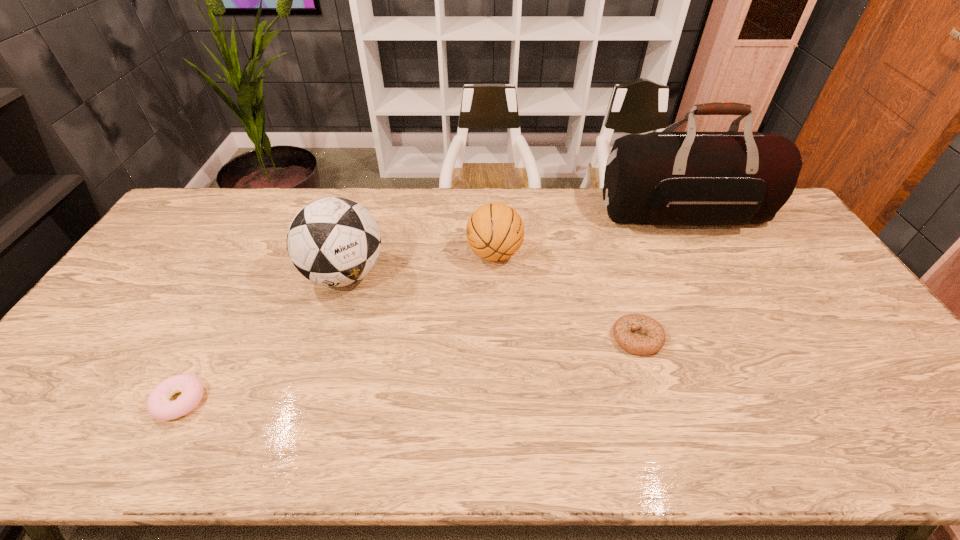
Locate an element on the screen. duffel bag is located at coordinates (691, 178).

The width and height of the screenshot is (960, 540). In order to click on the second object from left to right in this screenshot , I will do `click(332, 241)`.

This screenshot has width=960, height=540. Identify the location of the fourth shortest object. (332, 241).

Find the location of `the third tallest object`. the third tallest object is located at coordinates (495, 231).

Locate an element on the screen. The height and width of the screenshot is (540, 960). the third object from right to left is located at coordinates (495, 231).

Identify the location of the fourth farthest object. This screenshot has width=960, height=540. (655, 338).

Find the location of a particular element. Image resolution: width=960 pixels, height=540 pixels. the nearest object is located at coordinates (159, 407).

You are a GUI agent. You are given a task and a screenshot of the screen. Output one action in this format:
    pyautogui.click(x=<x>, y=<y>)
    Task: Click on the doughnut
    
    Given the screenshot: What is the action you would take?
    pyautogui.click(x=159, y=407)

The width and height of the screenshot is (960, 540). I want to click on free space located 0.240m on the front pocket of the duffel bag, so click(725, 292).

Locate an element on the screen. free point located 0.170m on the surface of the fourth object from right to left where the brand logo is visible is located at coordinates (320, 355).